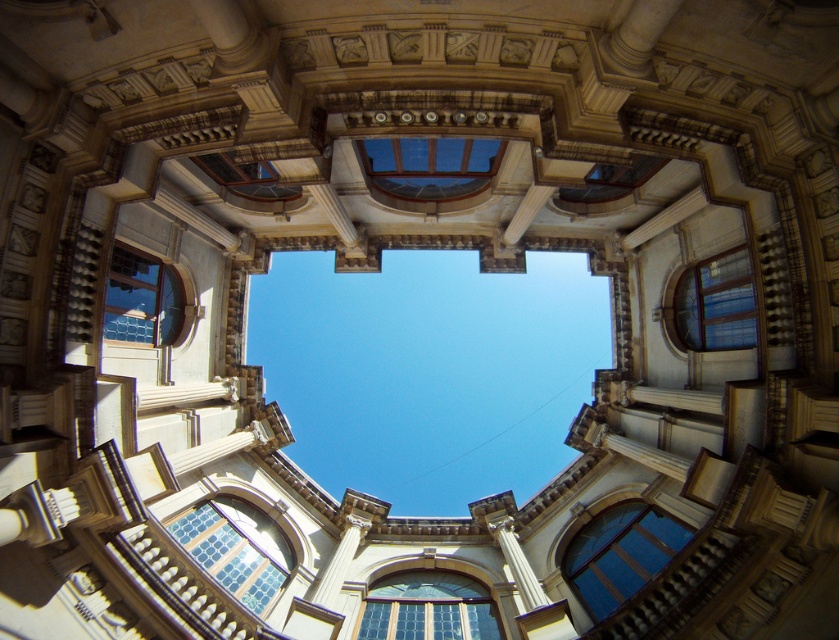
You are standing inside the grand architectural space and want to take a photo of the stained glass window at lower left. Based on its 2D location coordinates, which quadrant of the image should you look towards?

The stained glass window at lower left is located at coordinates point (236, 548). Since the x coordinate is 0.858, which is closer to the right edge of the image, and the y coordinate is 0.282, closer to the bottom, it is in the lower right quadrant of the image.

You are a maintenance worker needing to replace a broken stained glass window. You have a ladder that can reach up to 25 meters. You see the stained glass window at lower left and the stained glass window at left. Which window can you safely reach with your current ladder?

The stained glass window at lower left is closer to the ground than the stained glass window at left. Since the ladder can only reach up to 25 meters and the distance between them is 26.53 meters, you can only safely reach the stained glass window at lower left.

You are an architect examining the grand structure. You notice the blue glass window at lower right and the stained glass window at left. Which one has a larger size?

The blue glass window at lower right is bigger than the stained glass window at left.